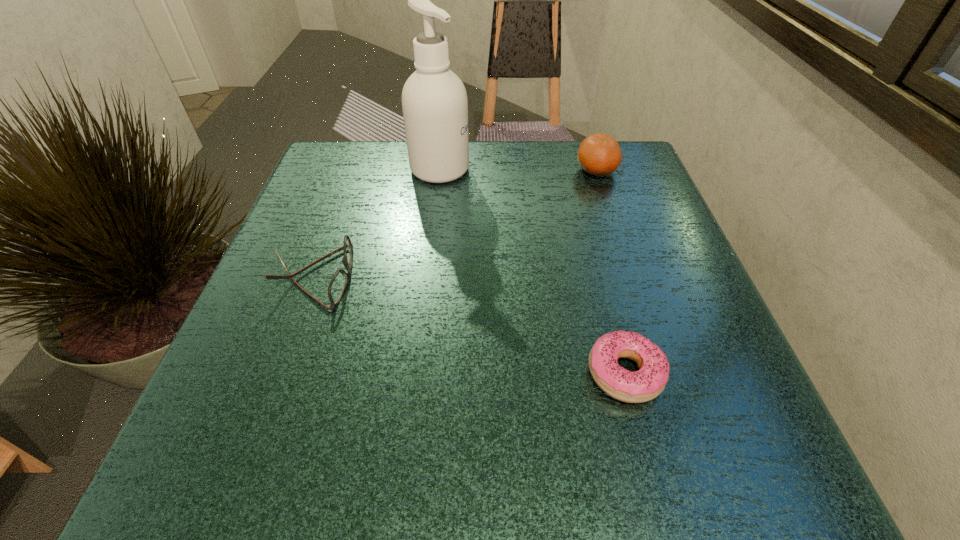
Image resolution: width=960 pixels, height=540 pixels. What are the coordinates of `vacant region at the far left corner of the desktop` in the screenshot? It's located at (354, 145).

The height and width of the screenshot is (540, 960). In the image, there is a desktop. Identify the location of free space at the near left corner. (270, 491).

Locate an element on the screen. This screenshot has width=960, height=540. blank space at the near right corner of the desktop is located at coordinates (682, 472).

Where is `free space between the tallest object and the leftmost object`? Image resolution: width=960 pixels, height=540 pixels. free space between the tallest object and the leftmost object is located at coordinates (376, 223).

Locate an element on the screen. This screenshot has height=540, width=960. vacant area that lies between the clementine and the cleansing agent is located at coordinates (518, 170).

Where is `vacant space that is in between the nearest object and the third shortest object`? The width and height of the screenshot is (960, 540). vacant space that is in between the nearest object and the third shortest object is located at coordinates (611, 272).

You are a GUI agent. You are given a task and a screenshot of the screen. Output one action in this format:
    pyautogui.click(x=<x>, y=<y>)
    Task: Click on the unoccupied position between the second nearest object and the nearest object
    This screenshot has width=960, height=540.
    Given the screenshot: What is the action you would take?
    pyautogui.click(x=469, y=326)

I want to click on free space between the cleansing agent and the doughnut, so click(533, 271).

What are the coordinates of `free space between the cleansing agent and the spectacles` in the screenshot? It's located at (376, 223).

Identify the location of empty space that is in between the second tallest object and the leftmost object. point(455,224).